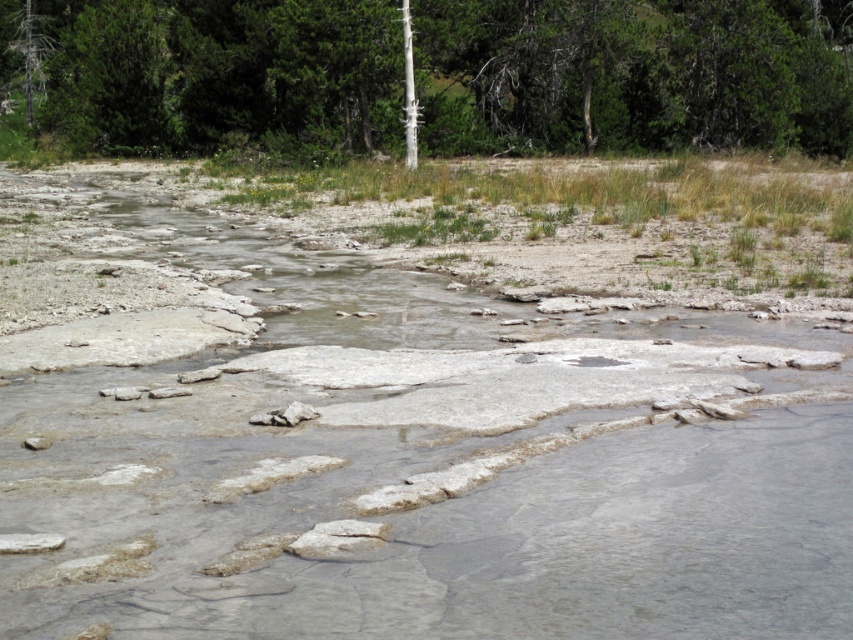
Question: Can you confirm if gray stone river at center is smaller than green textured tree at upper center?

Choices:
 (A) no
 (B) yes

Answer: (B)

Question: Can you confirm if gray stone river at center is bigger than green textured tree at upper center?

Choices:
 (A) no
 (B) yes

Answer: (A)

Question: Can you confirm if gray stone river at center is smaller than green textured tree at upper center?

Choices:
 (A) no
 (B) yes

Answer: (B)

Question: Among these objects, which one is farthest from the camera?

Choices:
 (A) green textured tree at upper center
 (B) gray stone river at center

Answer: (A)